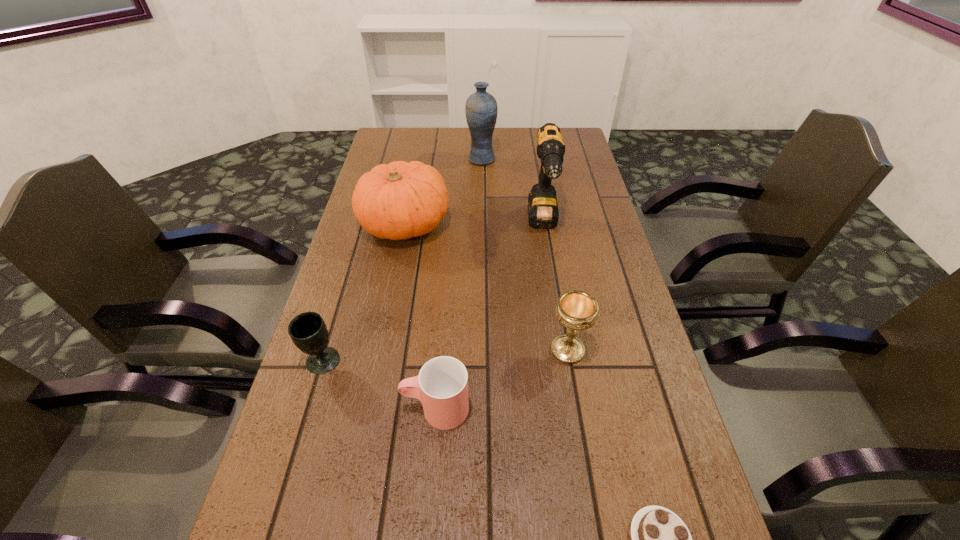
Find the location of `vacant space located on the back of the left chalice`. vacant space located on the back of the left chalice is located at coordinates (359, 241).

Locate an element on the screen. Image resolution: width=960 pixels, height=540 pixels. vacant space located 0.150m on the side of the third nearest object with the handle is located at coordinates (328, 409).

The height and width of the screenshot is (540, 960). I want to click on free space located on the side of the third nearest object with the handle, so click(x=309, y=409).

You are a GUI agent. You are given a task and a screenshot of the screen. Output one action in this format:
    pyautogui.click(x=<x>, y=<y>)
    Task: Click on the vacant space located 0.100m on the side of the third nearest object with the handle
    The image size is (960, 540).
    Given the screenshot: What is the action you would take?
    353,409

Identify the location of object positioned at the far edge. This screenshot has width=960, height=540. (481, 109).

In order to click on pumpkin present at the left edge in this screenshot , I will do `click(401, 200)`.

Find the location of a particular element. chalice at the left edge is located at coordinates (308, 331).

You are a GUI agent. You are given a task and a screenshot of the screen. Output one action in this format:
    pyautogui.click(x=<x>, y=<y>)
    Task: Click on the drill situated at the right edge
    This screenshot has height=540, width=960.
    Given the screenshot: What is the action you would take?
    pyautogui.click(x=543, y=212)

In order to click on chalice present at the right edge in this screenshot , I will do `click(577, 310)`.

The image size is (960, 540). I want to click on vacant space at the far edge of the desktop, so click(533, 153).